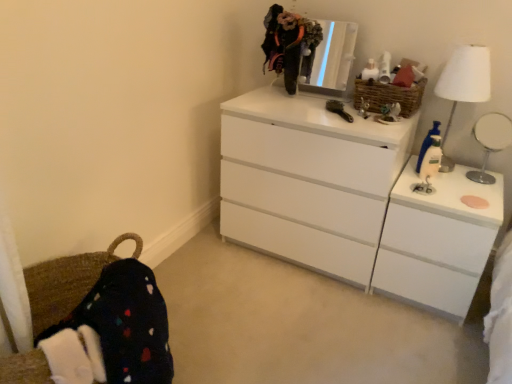
The width and height of the screenshot is (512, 384). I want to click on free space to the left of white glossy mirror at upper right, so click(x=452, y=182).